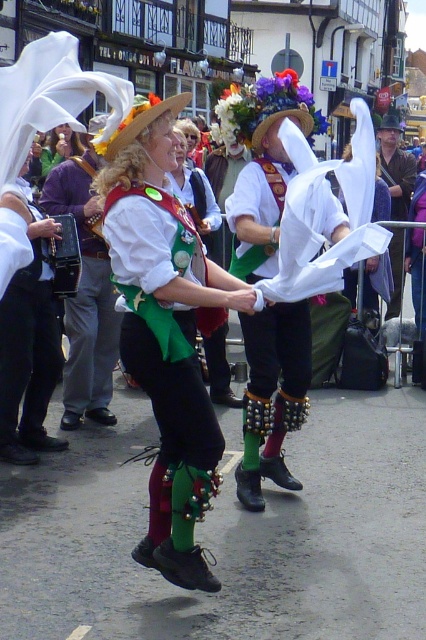
Which is above, green velvet vest at center or brown leather jacket at center?

brown leather jacket at center is higher up.

Which is more to the left, green velvet vest at center or brown leather jacket at center?

From the viewer's perspective, green velvet vest at center appears more on the left side.

Identify the location of green velvet vest at center. The image size is (426, 640). (166, 328).